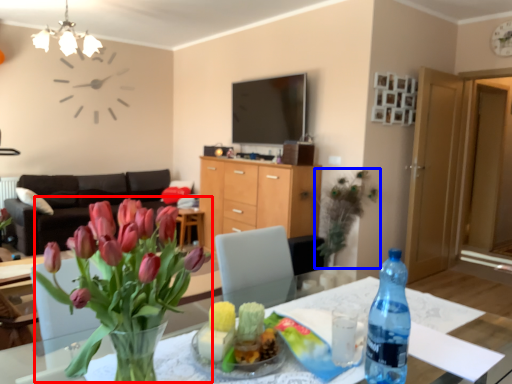
Question: Which of the following is the farthest to the observer, floral arrangement (highlighted by a red box) or houseplant (highlighted by a blue box)?

Choices:
 (A) floral arrangement
 (B) houseplant

Answer: (B)